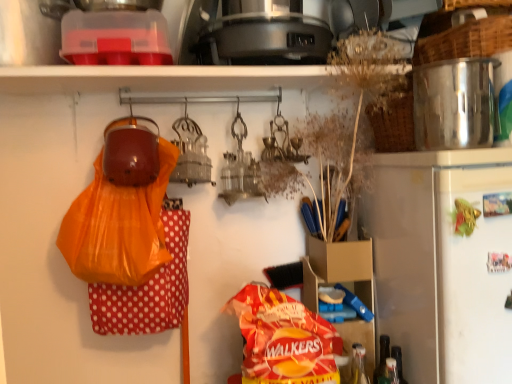
Question: Based on their positions, is satin silver refrigerator at right located to the left or right of shiny metallic pot at upper right?

Choices:
 (A) right
 (B) left

Answer: (A)

Question: Based on their sizes in the image, would you say satin silver refrigerator at right is bigger or smaller than shiny metallic pot at upper right?

Choices:
 (A) small
 (B) big

Answer: (B)

Question: Which object is positioned closest to the silver metallic pot at upper right?

Choices:
 (A) satin silver refrigerator at right
 (B) shiny metallic pot at upper right
 (C) orange plastic bag at left
 (D) translucent plastic bottle at lower right, the first bottle when ordered from right to left
 (E) translucent plastic bottle at lower right, acting as the first bottle starting from the left

Answer: (B)

Question: Which is farther from the red matte bag of walkers chips at center?

Choices:
 (A) silver metallic pot at upper right
 (B) satin silver refrigerator at right
 (C) shiny metallic pot at upper right
 (D) orange plastic bag at left
 (E) translucent plastic bottle at lower right, the first bottle when ordered from right to left

Answer: (A)